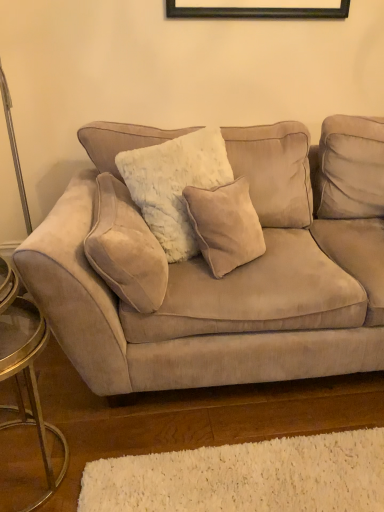
Question: Is beige suede pillow at left not within metallic gold side table at left?

Choices:
 (A) no
 (B) yes

Answer: (B)

Question: From a real-world perspective, is beige suede pillow at left under metallic gold side table at left?

Choices:
 (A) yes
 (B) no

Answer: (B)

Question: From a real-world perspective, is beige suede pillow at left physically above metallic gold side table at left?

Choices:
 (A) yes
 (B) no

Answer: (A)

Question: Is beige suede pillow at left to the right of metallic gold side table at left from the viewer's perspective?

Choices:
 (A) yes
 (B) no

Answer: (A)

Question: Considering the relative sizes of beige suede pillow at left and metallic gold side table at left in the image provided, is beige suede pillow at left shorter than metallic gold side table at left?

Choices:
 (A) yes
 (B) no

Answer: (A)

Question: Can you confirm if beige suede pillow at left is taller than metallic gold side table at left?

Choices:
 (A) yes
 (B) no

Answer: (B)

Question: Can you confirm if metallic gold side table at left is smaller than white shag rug at lower center?

Choices:
 (A) yes
 (B) no

Answer: (B)

Question: Is metallic gold side table at left not close to white shag rug at lower center?

Choices:
 (A) no
 (B) yes

Answer: (A)

Question: Is white shag rug at lower center surrounded by metallic gold side table at left?

Choices:
 (A) yes
 (B) no

Answer: (B)

Question: Is metallic gold side table at left at the left side of white shag rug at lower center?

Choices:
 (A) yes
 (B) no

Answer: (A)

Question: Is metallic gold side table at left bigger than white shag rug at lower center?

Choices:
 (A) no
 (B) yes

Answer: (B)

Question: From the image's perspective, does metallic gold side table at left appear higher than white shag rug at lower center?

Choices:
 (A) yes
 (B) no

Answer: (A)

Question: Is beige suede pillow at left at the left side of suede couch at center?

Choices:
 (A) no
 (B) yes

Answer: (B)